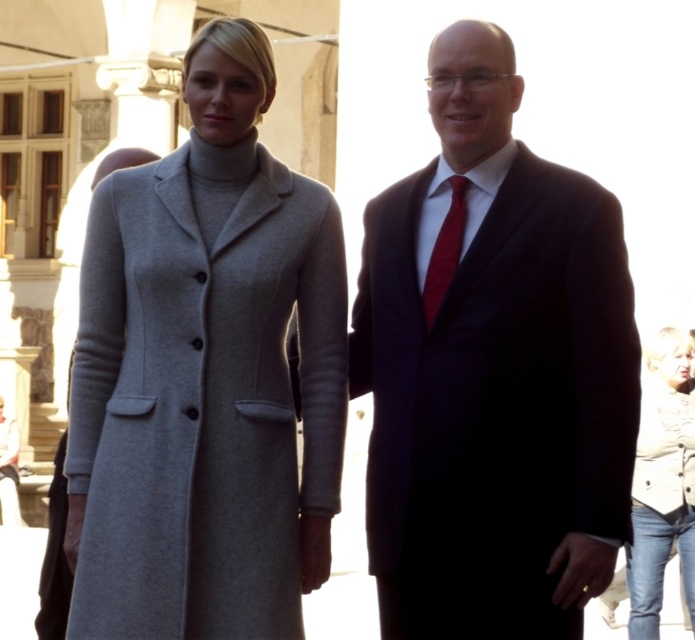
Based on the photo, you are a photographer setting up for a group photo in the public space. You need to ensure that the gray wool coat at left is visible in the frame. Where should you position the camera relative to the coat?

The gray wool coat at left is located at point (202,403). To ensure visibility, position the camera so it captures this coordinate within the frame.